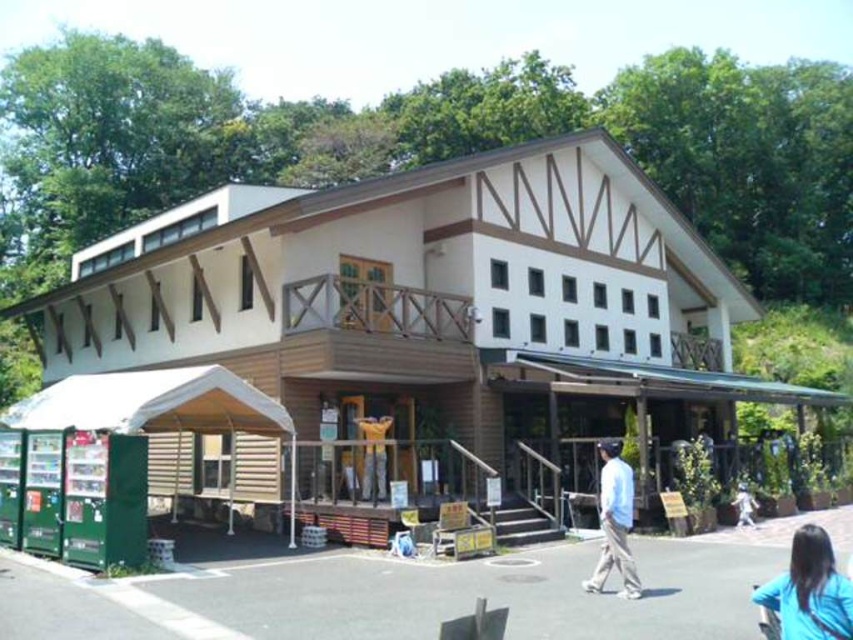
Question: Which object is farther from the camera taking this photo?

Choices:
 (A) light blue shirt at center
 (B) blue fabric shirt at lower right

Answer: (A)

Question: Estimate the real-world distances between objects in this image. Which object is farther from the wooden statue at center?

Choices:
 (A) blue fabric shirt at lower right
 (B) light blue shirt at center
 (C) white cotton shirt at lower right

Answer: (A)

Question: Which object is closer to the camera taking this photo?

Choices:
 (A) wooden statue at center
 (B) white cotton shirt at lower right
 (C) blue fabric shirt at lower right

Answer: (C)

Question: Can you confirm if wooden statue at center is positioned above white cotton shirt at lower right?

Choices:
 (A) no
 (B) yes

Answer: (B)

Question: Is light blue shirt at center to the right of white cotton shirt at lower right from the viewer's perspective?

Choices:
 (A) yes
 (B) no

Answer: (B)

Question: Where is blue fabric shirt at lower right located in relation to light blue shirt at center in the image?

Choices:
 (A) left
 (B) right

Answer: (B)